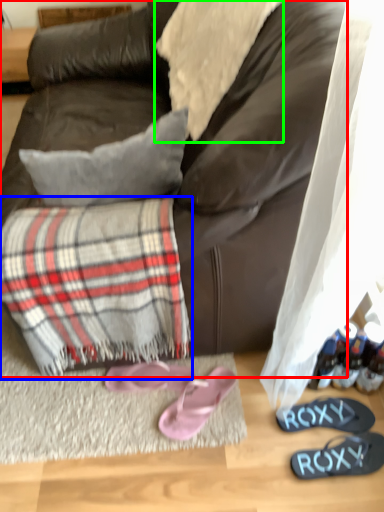
Question: Which object is positioned farthest from studio couch (highlighted by a red box)? Select from flannel (highlighted by a blue box) and cloth (highlighted by a green box).

Choices:
 (A) flannel
 (B) cloth

Answer: (A)